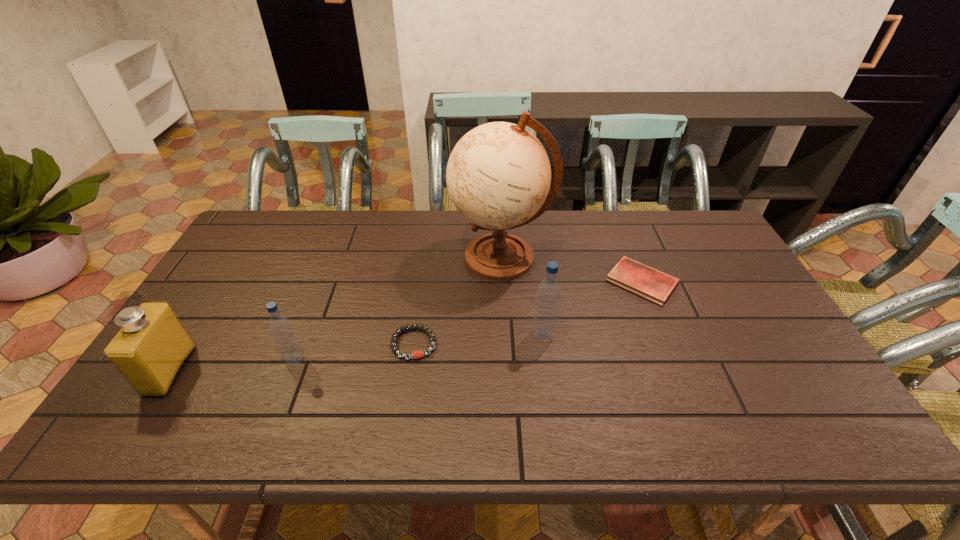
Observe the arrangement of all water bottles in the image. To keep them evenly spaced, where would you place another water bottle on the right? Please locate a free space. Please provide its 2D coordinates. Your answer should be formatted as a tuple, i.e. [(x, y)], where the tuple contains the x and y coordinates of a point satisfying the conditions above.

[(767, 313)]